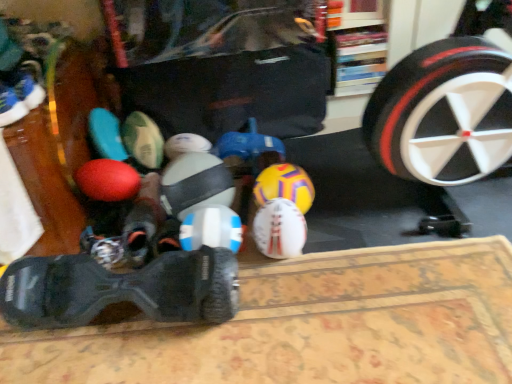
Question: Does point (263, 170) appear closer or farther from the camera than point (198, 168)?

Choices:
 (A) closer
 (B) farther

Answer: (B)

Question: Is yellow matte soccer ball at center, arranged as the 4th toy when viewed from the left, situated inside white matte soccer ball at center, the 1th toy in the left-to-right sequence, or outside?

Choices:
 (A) inside
 (B) outside

Answer: (B)

Question: Considering the real-world distances, which object is closest to the white matte soccer ball at center, arranged as the 2th toy when viewed from the right?

Choices:
 (A) white matte soccer ball at center, the fourth toy from the right
 (B) carpeted mat at lower center
 (C) blue suede shoe at left, which appears as the first footwear when viewed from the top
 (D) yellow matte soccer ball at center, arranged as the 4th toy when viewed from the left
 (E) white plastic remote control at center, arranged as the 3th toy when viewed from the right

Answer: (D)

Question: Based on their relative distances, which object is farther from the white matte soccer ball at center, the fourth toy from the right?

Choices:
 (A) white matte soccer ball at center, arranged as the 2th toy when viewed from the right
 (B) blue suede shoe at left, which appears as the first footwear when viewed from the top
 (C) carpeted mat at lower center
 (D) yellow matte soccer ball at center, arranged as the 4th toy when viewed from the left
 (E) white plastic remote control at center, arranged as the 3th toy when viewed from the right

Answer: (B)